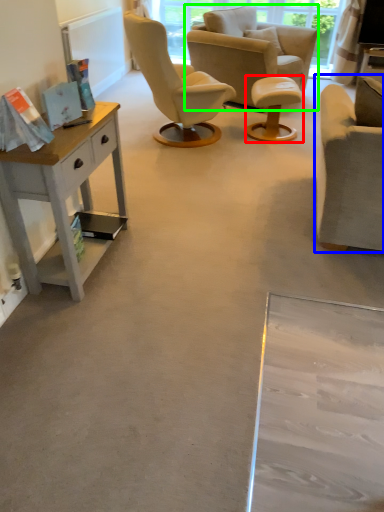
Question: Considering the real-world distances, which object is closest to stool (highlighted by a red box)? chair (highlighted by a blue box) or chair (highlighted by a green box).

Choices:
 (A) chair
 (B) chair

Answer: (B)